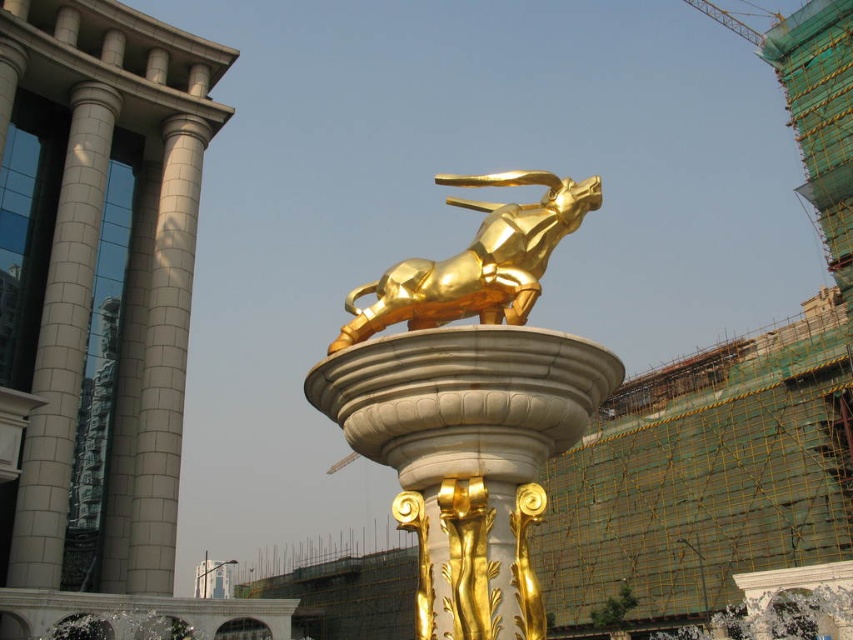
You are standing in front of the statue and want to take a photo with your phone. The statue is 15.37 meters away from you. Your phone can focus up to 10 meters. Will you be able to take a clear photo of the gold polished statue at center?

The gold polished statue at center is 15.37 meters away from the camera, which is beyond the phone camera focus limit of 10 meters. Therefore, the photo may not be clear.

You are standing in front of the golden statue of the leaping bull. You notice two points marked on the statue. The first point is at coordinates point (515, 467) and the second point is at point (494, 264). Which point is closer to you?

Point (515, 467) is closer to the camera than point (494, 264), so the first point is closer to you.

You are standing in front of the pedestal and want to place a small flower pot exactly at the same 2D location as the gold polished statue at center. What coordinate should you use?

The gold polished statue at center is located at coordinate point (469, 403), so you should place the flower pot at the same coordinates.